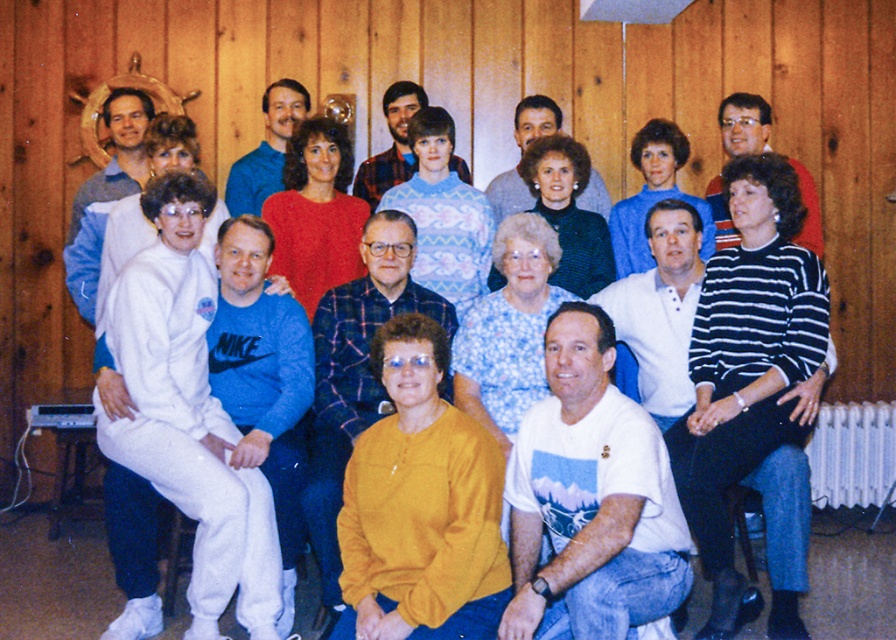
Question: Is white cotton t-shirt at lower center thinner than blue floral dress at center?

Choices:
 (A) yes
 (B) no

Answer: (B)

Question: Which object is farther from the camera taking this photo?

Choices:
 (A) dark green sweater at center
 (B) blue floral dress at center
 (C) matte blue sweater at center

Answer: (C)

Question: Among these points, which one is farthest from the camera?

Choices:
 (A) (303, 138)
 (B) (583, 289)
 (C) (586, 483)

Answer: (A)

Question: Which of the following is the closest to the observer?

Choices:
 (A) dark green sweater at center
 (B) red sweater at center
 (C) white cotton t-shirt at lower center
 (D) matte blue sweater at center

Answer: (C)

Question: Does blue floral dress at center lie behind dark green sweater at center?

Choices:
 (A) no
 (B) yes

Answer: (A)

Question: Does blue floral dress at center lie behind matte blue sweater at center?

Choices:
 (A) no
 (B) yes

Answer: (A)